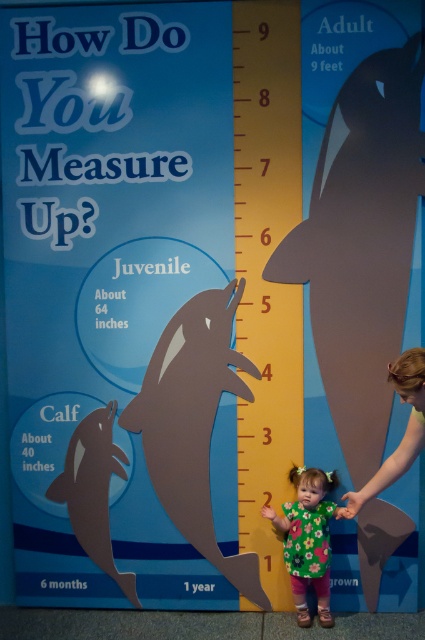
Question: Which of the following is the farthest from the observer?

Choices:
 (A) 178,388
 (B) 99,429

Answer: (B)

Question: Can you confirm if gray matte whale at right is positioned to the right of matte black dolphin at lower left?

Choices:
 (A) yes
 (B) no

Answer: (A)

Question: Does floral dress at center appear under smooth brown hair at lower right?

Choices:
 (A) yes
 (B) no

Answer: (A)

Question: Which of the following is the farthest from the observer?

Choices:
 (A) (399, 444)
 (B) (150, 451)
 (C) (399, 228)

Answer: (B)

Question: Is matte gray dolphin at center below floral dress at center?

Choices:
 (A) no
 (B) yes

Answer: (A)

Question: Which object appears farthest from the camera in this image?

Choices:
 (A) floral dress at center
 (B) smooth brown hair at lower right

Answer: (A)